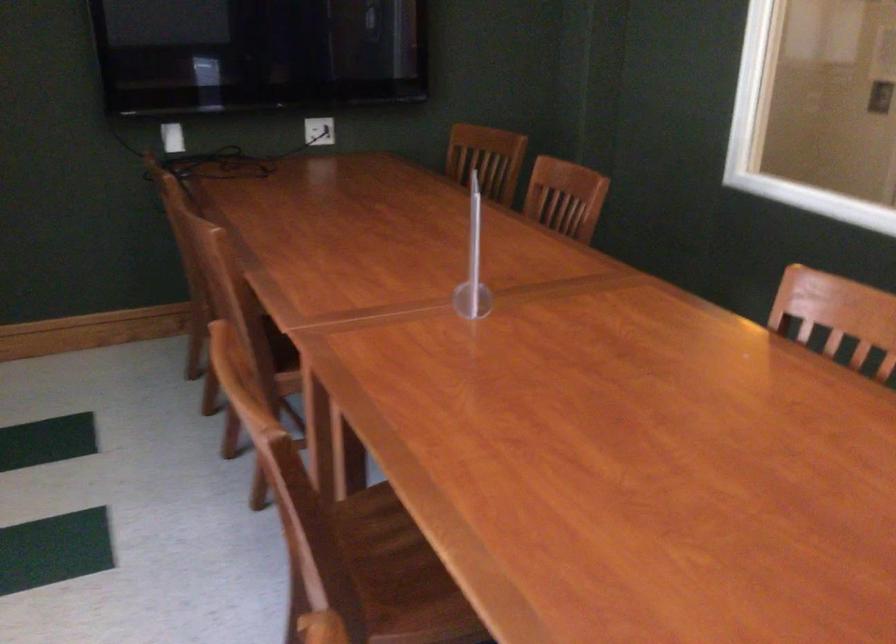
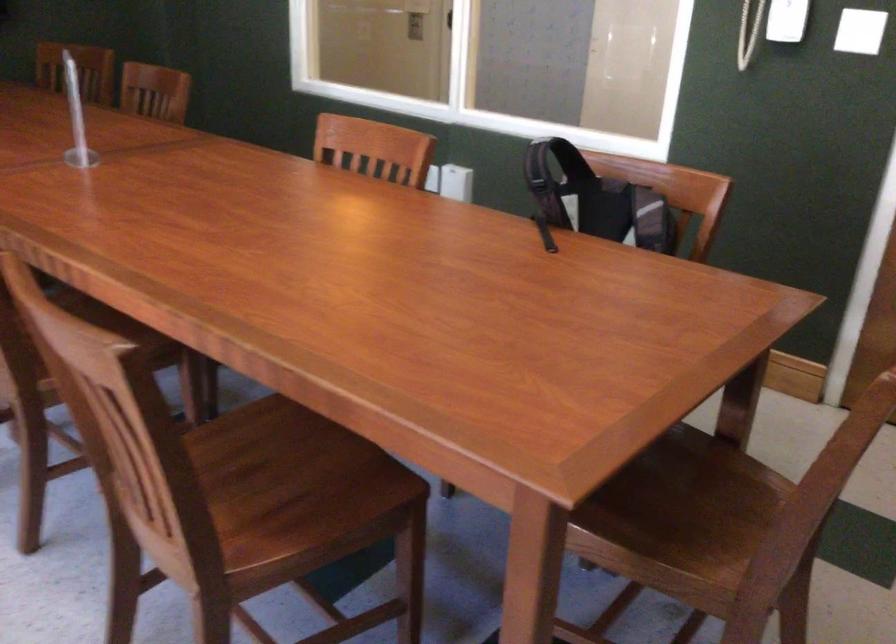
Question: The camera is either moving clockwise (left) or counter-clockwise (right) around the object. The first image is from the beginning of the video and the second image is from the end. Is the camera moving left or right when shooting the video?

Choices:
 (A) Left
 (B) Right

Answer: (A)